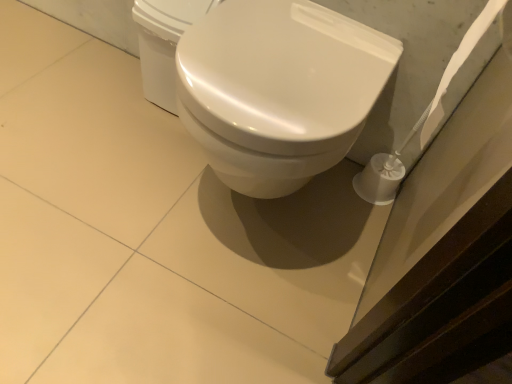
What do you see at coordinates (278, 90) in the screenshot? I see `white glossy toilet at center` at bounding box center [278, 90].

What are the coordinates of `white glossy toilet at center` in the screenshot? It's located at (278, 90).

Describe the element at coordinates (163, 43) in the screenshot. I see `white glossy toilet at upper center` at that location.

Identify the location of white glossy toilet at upper center. The width and height of the screenshot is (512, 384). click(x=163, y=43).

You are a GUI agent. You are given a task and a screenshot of the screen. Output one action in this format:
    pyautogui.click(x=<x>, y=<y>)
    Task: Click on the white glossy toilet at center
    
    Given the screenshot: What is the action you would take?
    pyautogui.click(x=278, y=90)

Considering the relative positions of white glossy toilet at center and white glossy toilet at upper center in the image provided, is white glossy toilet at center to the left or to the right of white glossy toilet at upper center?

white glossy toilet at center is positioned on white glossy toilet at upper center's right side.

Is the position of white glossy toilet at center more distant than that of white glossy toilet at upper center?

No, it is not.

Is point (237, 102) closer or farther from the camera than point (165, 27)?

Point (237, 102).

From the image's perspective, relative to white glossy toilet at upper center, is white glossy toilet at center above or below?

From the image's perspective, white glossy toilet at center appears below white glossy toilet at upper center.

From a real-world perspective, which object stands above the other?

white glossy toilet at center.

Based on the photo, between white glossy toilet at center and white glossy toilet at upper center, which one has larger width?

With larger width is white glossy toilet at center.

Is white glossy toilet at center shorter than white glossy toilet at upper center?

Incorrect, the height of white glossy toilet at center does not fall short of that of white glossy toilet at upper center.

Considering the sizes of objects white glossy toilet at center and white glossy toilet at upper center in the image provided, who is smaller, white glossy toilet at center or white glossy toilet at upper center?

white glossy toilet at upper center.

Choose the correct answer: Is white glossy toilet at center inside white glossy toilet at upper center or outside it?

white glossy toilet at center is not inside white glossy toilet at upper center, it's outside.

Is white glossy toilet at center in contact with white glossy toilet at upper center?

No, white glossy toilet at center is not making contact with white glossy toilet at upper center.

Could you tell me if white glossy toilet at center is facing white glossy toilet at upper center?

No, white glossy toilet at center is not facing towards white glossy toilet at upper center.

How many degrees apart are the facing directions of white glossy toilet at center and white glossy toilet at upper center?

There is a 0.167-degree angle between the facing directions of white glossy toilet at center and white glossy toilet at upper center.

Identify the location of porcelain behind the white glossy toilet at center. The image size is (512, 384). (163, 43).

Which is more to the left, white glossy toilet at upper center or white glossy toilet at center?

Positioned to the left is white glossy toilet at upper center.

Relative to white glossy toilet at center, is white glossy toilet at upper center in front or behind?

Visually, white glossy toilet at upper center is located behind white glossy toilet at center.

Which is closer, (198, 4) or (206, 131)?

The point (206, 131) is closer.

From the image's perspective, is white glossy toilet at upper center above or below white glossy toilet at center?

Clearly, from the image's perspective, white glossy toilet at upper center is above white glossy toilet at center.

Consider the image. From a real-world perspective, is white glossy toilet at upper center positioned above or below white glossy toilet at center?

From a real-world perspective, white glossy toilet at upper center is physically below white glossy toilet at center.

Considering the sizes of objects white glossy toilet at upper center and white glossy toilet at center in the image provided, who is wider, white glossy toilet at upper center or white glossy toilet at center?

white glossy toilet at center is wider.

Who is shorter, white glossy toilet at upper center or white glossy toilet at center?

white glossy toilet at upper center.

Based on their sizes in the image, would you say white glossy toilet at upper center is bigger or smaller than white glossy toilet at center?

Clearly, white glossy toilet at upper center is smaller in size than white glossy toilet at center.

Is white glossy toilet at center completely or partially inside white glossy toilet at upper center?

No, white glossy toilet at center is not surrounded by white glossy toilet at upper center.

Is white glossy toilet at upper center not near white glossy toilet at center?

No, there isn't a large distance between white glossy toilet at upper center and white glossy toilet at center.

Is white glossy toilet at center at the back of white glossy toilet at upper center?

No, white glossy toilet at upper center is not facing away from white glossy toilet at center.

How distant is white glossy toilet at upper center from white glossy toilet at center?

The distance of white glossy toilet at upper center from white glossy toilet at center is 14.76 inches.

In order to click on toilet below the white glossy toilet at upper center (from the image's perspective) in this screenshot , I will do `click(278, 90)`.

Locate an element on the screen. porcelain that is behind the white glossy toilet at center is located at coordinates (163, 43).

At what (x,y) coordinates should I click in order to perform the action: click on porcelain above the white glossy toilet at center (from the image's perspective). Please return your answer as a coordinate pair (x, y). Looking at the image, I should click on (163, 43).